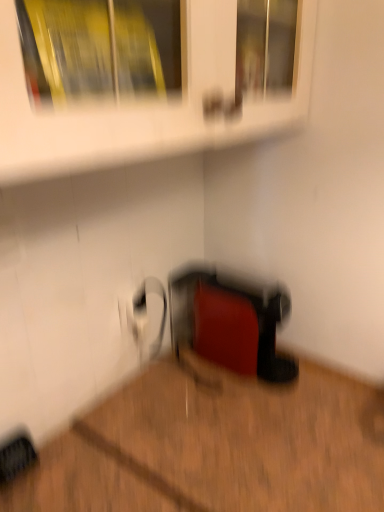
Question: From the image's perspective, is wooden floor at lower right above rubberized red toaster at lower center?

Choices:
 (A) no
 (B) yes

Answer: (A)

Question: Considering the relative sizes of wooden floor at lower right and rubberized red toaster at lower center in the image provided, is wooden floor at lower right wider than rubberized red toaster at lower center?

Choices:
 (A) no
 (B) yes

Answer: (B)

Question: Is the depth of wooden floor at lower right less than that of rubberized red toaster at lower center?

Choices:
 (A) yes
 (B) no

Answer: (A)

Question: Are wooden floor at lower right and rubberized red toaster at lower center beside each other?

Choices:
 (A) no
 (B) yes

Answer: (A)

Question: Is wooden floor at lower right surrounding rubberized red toaster at lower center?

Choices:
 (A) no
 (B) yes

Answer: (A)

Question: From a real-world perspective, is wooden floor at lower right located higher than rubberized red toaster at lower center?

Choices:
 (A) no
 (B) yes

Answer: (A)

Question: Does white glossy shelf at upper center have a lesser height compared to rubberized red toaster at lower center?

Choices:
 (A) yes
 (B) no

Answer: (B)

Question: From the image's perspective, is white glossy shelf at upper center located above rubberized red toaster at lower center?

Choices:
 (A) yes
 (B) no

Answer: (A)

Question: Is white glossy shelf at upper center outside of rubberized red toaster at lower center?

Choices:
 (A) no
 (B) yes

Answer: (B)

Question: Is white glossy shelf at upper center surrounding rubberized red toaster at lower center?

Choices:
 (A) no
 (B) yes

Answer: (A)

Question: Is white glossy shelf at upper center facing towards rubberized red toaster at lower center?

Choices:
 (A) no
 (B) yes

Answer: (A)

Question: Does white glossy shelf at upper center have a greater width compared to rubberized red toaster at lower center?

Choices:
 (A) yes
 (B) no

Answer: (A)

Question: From a real-world perspective, is rubberized red toaster at lower center below wooden floor at lower right?

Choices:
 (A) yes
 (B) no

Answer: (B)